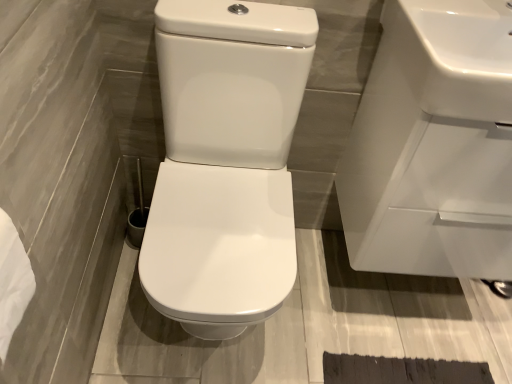
Question: From a real-world perspective, is white glossy sink at upper right, acting as the 2th sink starting from the back, positioned over white glossy toilet at center based on gravity?

Choices:
 (A) no
 (B) yes

Answer: (B)

Question: Is white glossy sink at upper right, acting as the 2th sink starting from the back, positioned with its back to white glossy toilet at center?

Choices:
 (A) no
 (B) yes

Answer: (A)

Question: Is white glossy sink at upper right, placed as the first sink when sorted from front to back, positioned beyond the bounds of white glossy toilet at center?

Choices:
 (A) yes
 (B) no

Answer: (A)

Question: Can you confirm if white glossy sink at upper right, acting as the 2th sink starting from the back, is shorter than white glossy toilet at center?

Choices:
 (A) yes
 (B) no

Answer: (A)

Question: Is there a large distance between white glossy sink at upper right, acting as the 2th sink starting from the back, and white glossy toilet at center?

Choices:
 (A) no
 (B) yes

Answer: (A)

Question: Does point (507, 46) appear closer or farther from the camera than point (188, 288)?

Choices:
 (A) farther
 (B) closer

Answer: (A)

Question: Considering the positions of white glossy sink at upper right, acting as the 2th sink starting from the back, and white glossy toilet at center in the image, is white glossy sink at upper right, acting as the 2th sink starting from the back, taller or shorter than white glossy toilet at center?

Choices:
 (A) tall
 (B) short

Answer: (B)

Question: Considering the positions of white glossy sink at upper right, acting as the 2th sink starting from the back, and white glossy toilet at center in the image, is white glossy sink at upper right, acting as the 2th sink starting from the back, bigger or smaller than white glossy toilet at center?

Choices:
 (A) small
 (B) big

Answer: (A)

Question: Looking at their shapes, would you say white glossy sink at upper right, placed as the first sink when sorted from front to back, is wider or thinner than white glossy toilet at center?

Choices:
 (A) thin
 (B) wide

Answer: (A)

Question: Is white glossy sink at upper right, arranged as the first sink when viewed from the back, wider or thinner than white glossy toilet at center?

Choices:
 (A) wide
 (B) thin

Answer: (B)

Question: Is point (x=495, y=107) positioned closer to the camera than point (x=158, y=288)?

Choices:
 (A) farther
 (B) closer

Answer: (B)

Question: Is white glossy sink at upper right, arranged as the first sink when viewed from the back, in front of or behind white glossy toilet at center in the image?

Choices:
 (A) front
 (B) behind

Answer: (B)

Question: Considering the relative positions of white glossy sink at upper right, arranged as the first sink when viewed from the back, and white glossy toilet at center in the image provided, is white glossy sink at upper right, arranged as the first sink when viewed from the back, to the left or to the right of white glossy toilet at center?

Choices:
 (A) left
 (B) right

Answer: (B)

Question: Is white glossy toilet at center spatially inside white glossy sink at upper right, placed as the first sink when sorted from front to back, or outside of it?

Choices:
 (A) outside
 (B) inside

Answer: (A)

Question: From a real-world perspective, is white glossy toilet at center positioned above or below white glossy sink at upper right, acting as the 2th sink starting from the back?

Choices:
 (A) below
 (B) above

Answer: (A)